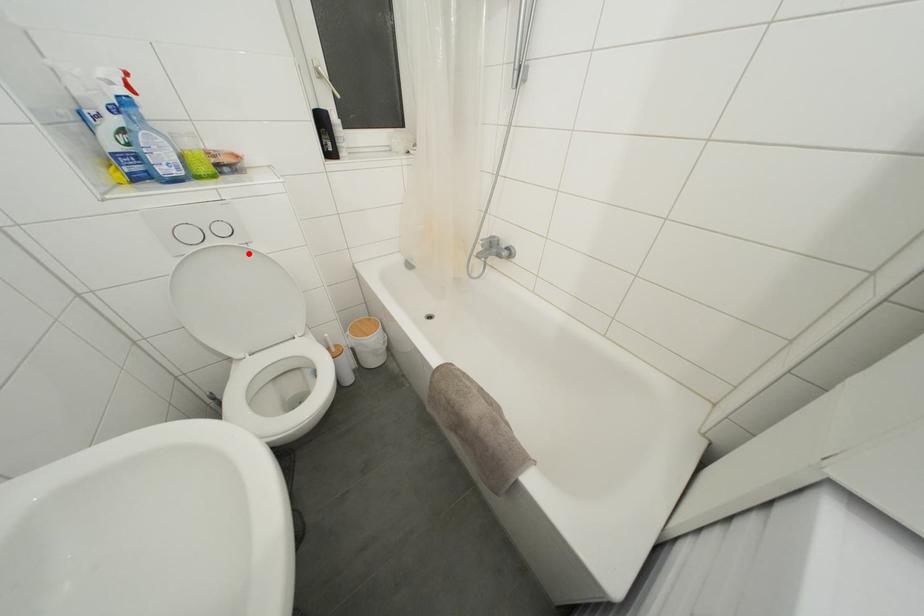
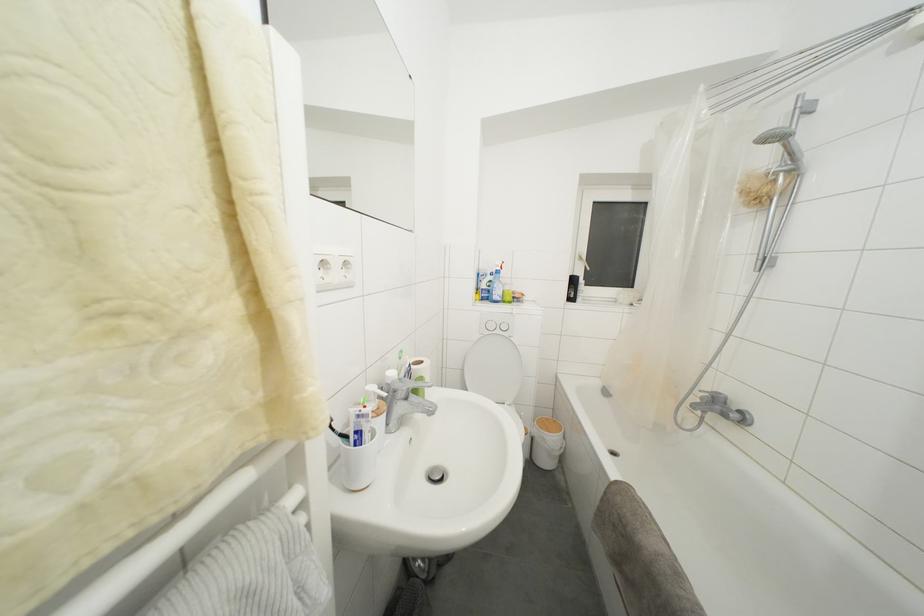
Where in the second image is the point corresponding to the highlighted location from the first image?

(513, 344)